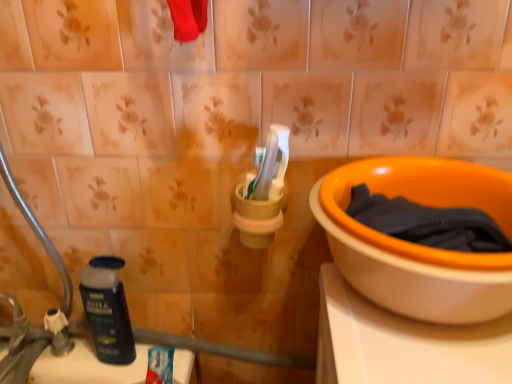
Question: Considering the relative sizes of dark blue fabric at right and orange ceramic bowl at right in the image provided, is dark blue fabric at right shorter than orange ceramic bowl at right?

Choices:
 (A) yes
 (B) no

Answer: (A)

Question: Can you confirm if dark blue fabric at right is positioned to the right of orange ceramic bowl at right?

Choices:
 (A) yes
 (B) no

Answer: (B)

Question: From a real-world perspective, is dark blue fabric at right on top of orange ceramic bowl at right?

Choices:
 (A) no
 (B) yes

Answer: (B)

Question: From a real-world perspective, is dark blue fabric at right located beneath orange ceramic bowl at right?

Choices:
 (A) yes
 (B) no

Answer: (B)

Question: Does dark blue fabric at right turn towards orange ceramic bowl at right?

Choices:
 (A) no
 (B) yes

Answer: (B)

Question: Does dark blue fabric at right appear on the left side of orange ceramic bowl at right?

Choices:
 (A) yes
 (B) no

Answer: (A)

Question: From a real-world perspective, is dark blue plastic bottle at lower left located beneath silver metallic faucet at lower left?

Choices:
 (A) yes
 (B) no

Answer: (B)

Question: Does dark blue plastic bottle at lower left lie in front of silver metallic faucet at lower left?

Choices:
 (A) yes
 (B) no

Answer: (B)

Question: Is dark blue plastic bottle at lower left at the right side of silver metallic faucet at lower left?

Choices:
 (A) yes
 (B) no

Answer: (A)

Question: Considering the relative sizes of dark blue plastic bottle at lower left and silver metallic faucet at lower left in the image provided, is dark blue plastic bottle at lower left bigger than silver metallic faucet at lower left?

Choices:
 (A) yes
 (B) no

Answer: (B)

Question: From a real-world perspective, does dark blue plastic bottle at lower left stand above silver metallic faucet at lower left?

Choices:
 (A) yes
 (B) no

Answer: (A)

Question: Is dark blue plastic bottle at lower left far away from silver metallic faucet at lower left?

Choices:
 (A) no
 (B) yes

Answer: (A)

Question: Does silver metallic faucet at lower left have a larger size compared to dark blue plastic bottle at lower left?

Choices:
 (A) yes
 (B) no

Answer: (A)